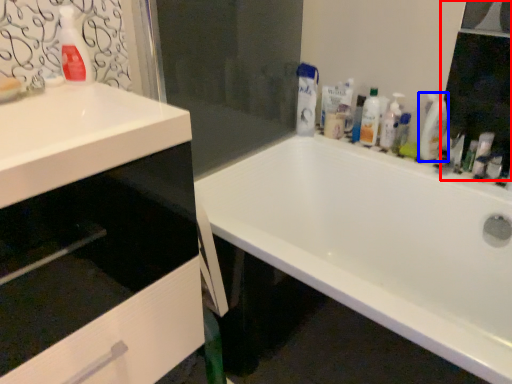
Question: Which object appears closest to the camera in this image, mirror (highlighted by a red box) or cleaning product (highlighted by a blue box)?

Choices:
 (A) mirror
 (B) cleaning product

Answer: (A)